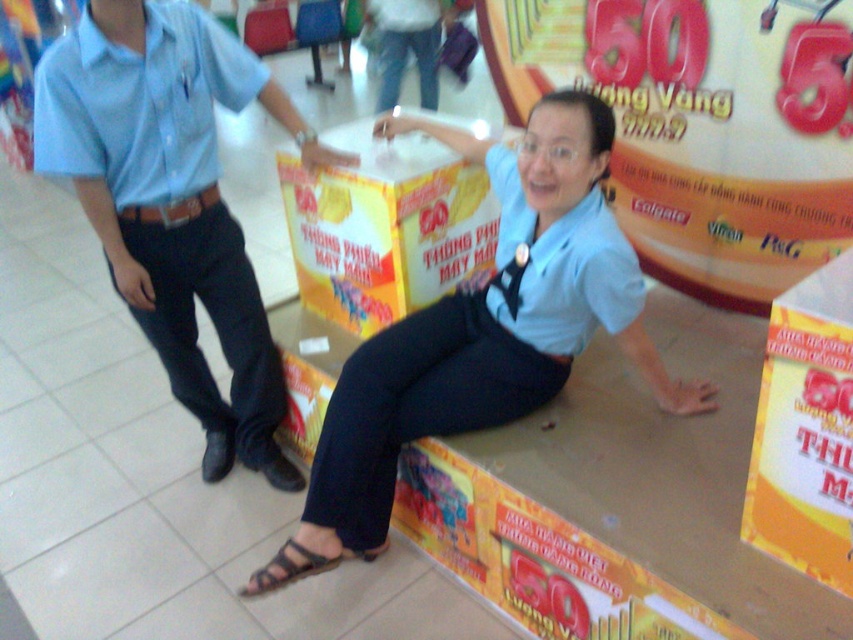
You are standing at the camera position and want to hand a brochure to the person wearing the light blue shirt at center. Can you reach them without moving from your current position?

The light blue shirt at center is 5.14 feet away from the camera, so you can reach them without moving since the distance is within arm reach.

You are a customer in the store and want to ask the woman in the light blue shirt at center a question. To approach her, you need to walk around the yellow cardboard box at center. Which side of the box should you go to in order to reach her?

The light blue shirt at center is positioned on the right side of the yellow cardboard box at center, so you should go to the right side of the yellow cardboard box at center to reach her.